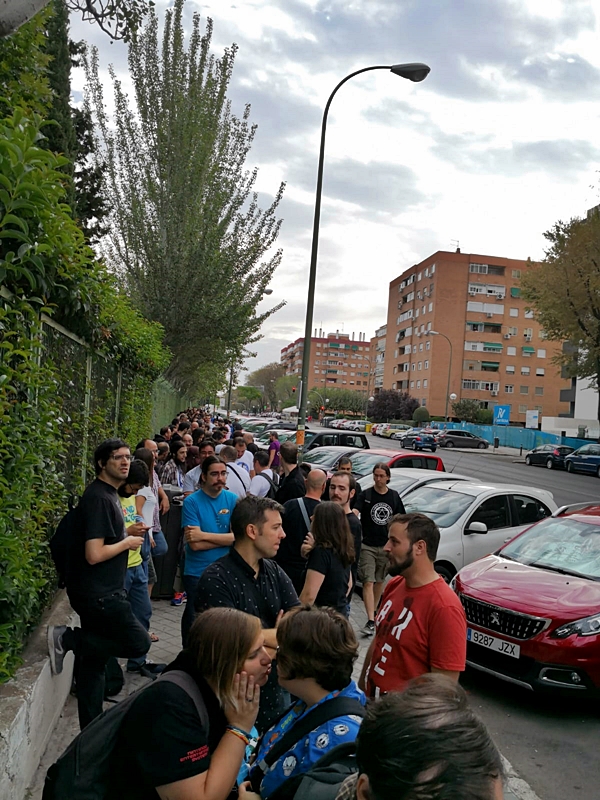
You are a GUI agent. You are given a task and a screenshot of the screen. Output one action in this format:
    pyautogui.click(x=<x>, y=<y>)
    Task: Click on the lamp
    
    Given the screenshot: What is the action you would take?
    pyautogui.click(x=387, y=62)